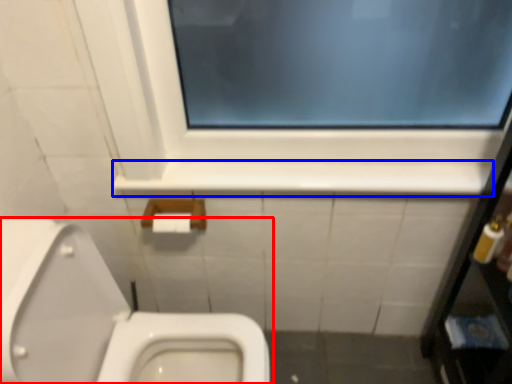
Question: Which point is closer to the camera, toilet (highlighted by a red box) or ledge (highlighted by a blue box)?

Choices:
 (A) toilet
 (B) ledge

Answer: (A)